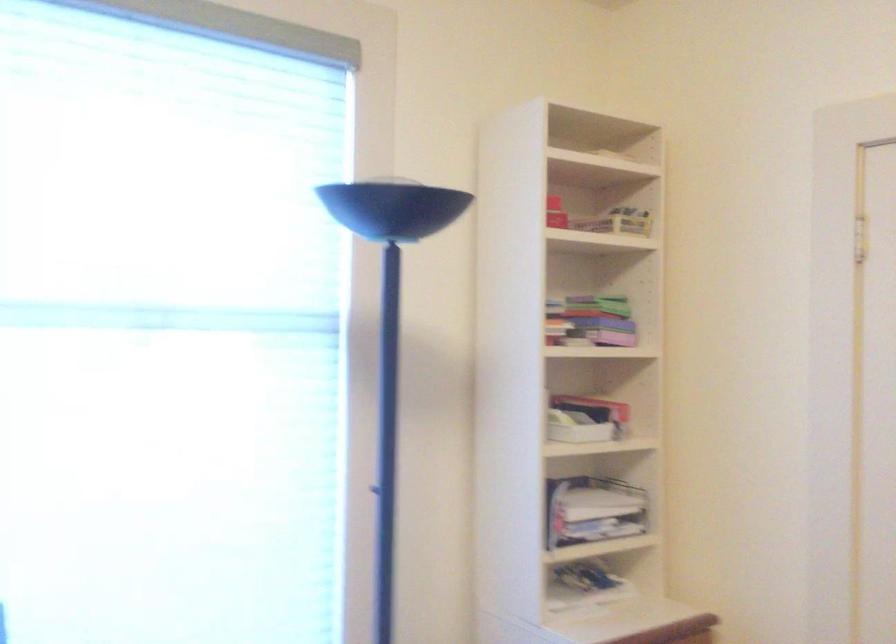
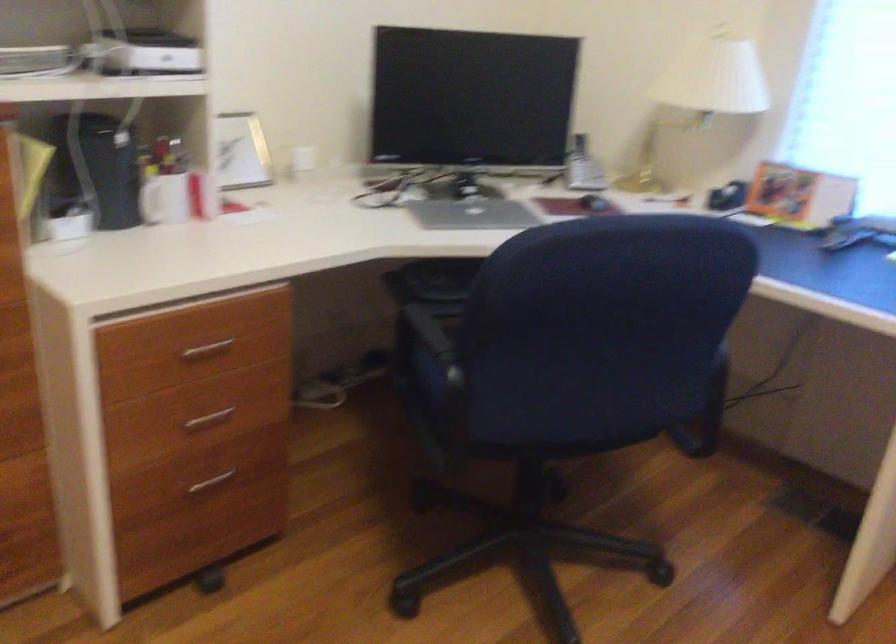
First-person continuous shooting, in which direction is the camera rotating?

The camera's rotation is toward left-down.